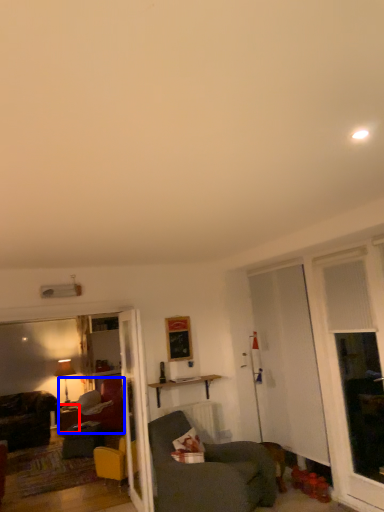
Question: Which of the following is the farthest to the observer, desk (highlighted by a red box) or studio couch (highlighted by a blue box)?

Choices:
 (A) desk
 (B) studio couch

Answer: (A)